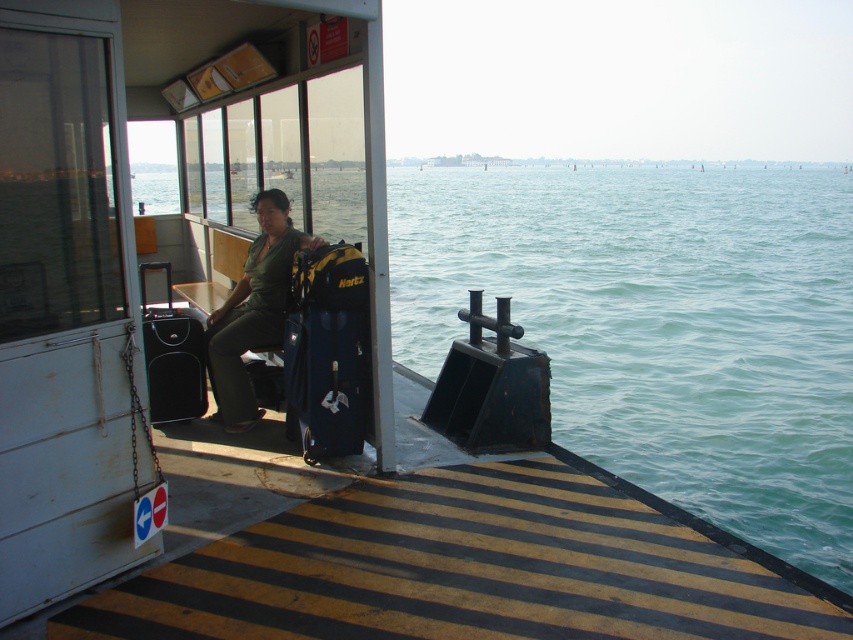
You are a passenger on the ferry and want to place your matte blue luggage at center. Where should you put it so that it doesn not block the aisle?

Since the matte blue luggage at center is located at coordinates point (328, 349), you should place it in a non aisle obstructing area like under the seat or in the luggage compartment.

Looking at this image, you are a passenger on the ferry and want to pick up the matte blue luggage at center and the green matte shirt at center. Which object should you reach for first to get the one closer to you?

The matte blue luggage at center is closer to the viewer than the green matte shirt at center, so you should reach for the matte blue luggage at center first.